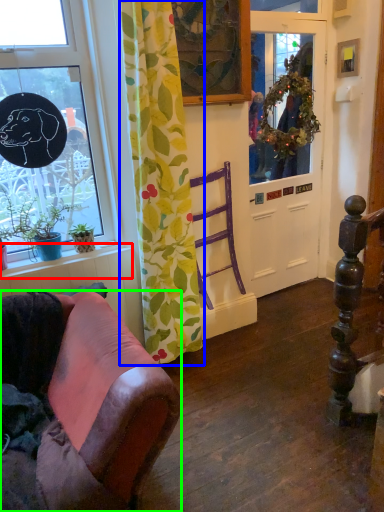
Question: Which object is positioned farthest from window sill (highlighted by a red box)? Select from curtain (highlighted by a blue box) and chair (highlighted by a green box).

Choices:
 (A) curtain
 (B) chair

Answer: (B)